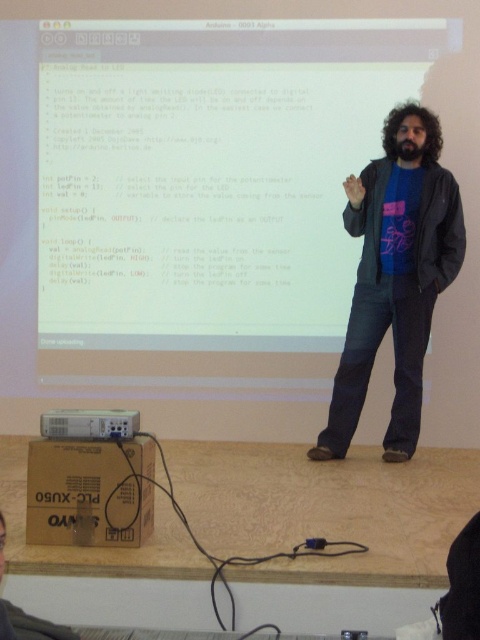
Question: Is blue cotton t-shirt at center to the left of white plastic projector at lower left from the viewer's perspective?

Choices:
 (A) yes
 (B) no

Answer: (B)

Question: Is blue cotton t-shirt at center above white plastic projector at lower left?

Choices:
 (A) yes
 (B) no

Answer: (A)

Question: Among these points, which one is farthest from the camera?

Choices:
 (A) (132, 413)
 (B) (355, 193)

Answer: (B)

Question: Can you confirm if blue cotton t-shirt at center is positioned below white plastic projector at lower left?

Choices:
 (A) yes
 (B) no

Answer: (B)